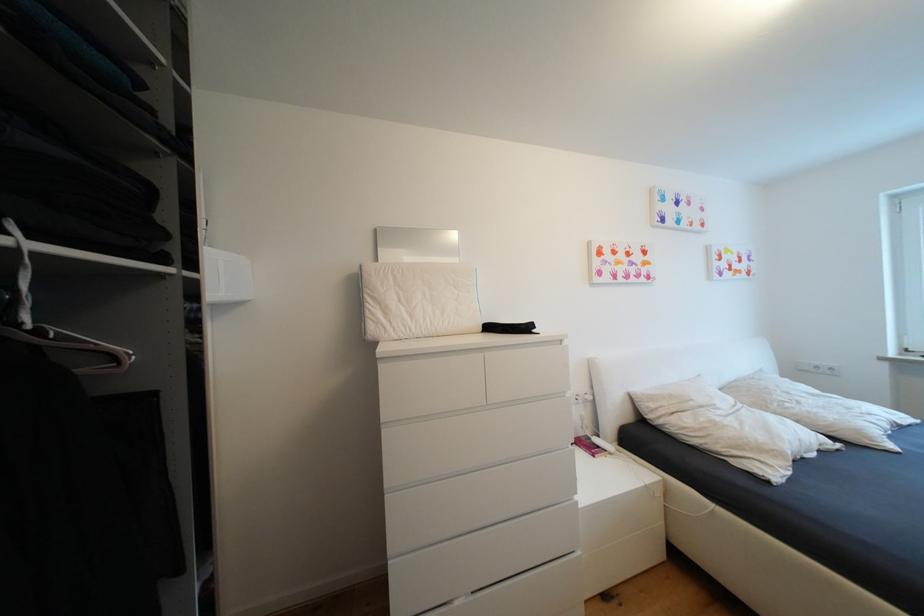
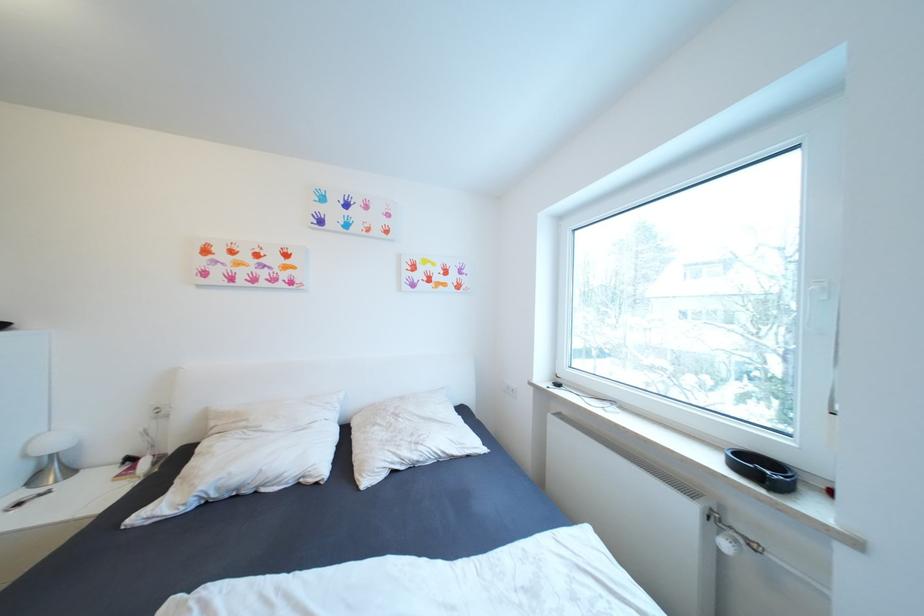
In the second image, find the point that corresponds to point 660,407 in the first image.

(220, 424)